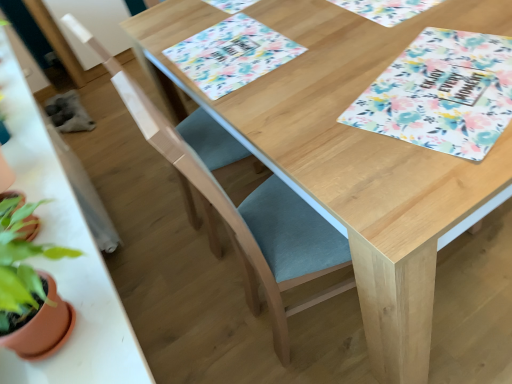
Question: From a real-world perspective, is floral fabric placemat at upper center, marked as the first place mat in a right-to-left arrangement, above or below teal fabric folding chair at center, placed as the 2th folding chair when sorted from front to back?

Choices:
 (A) above
 (B) below

Answer: (A)

Question: Is floral fabric placemat at upper center, marked as the first place mat in a right-to-left arrangement, inside the boundaries of teal fabric folding chair at center, the first folding chair viewed from the back, or outside?

Choices:
 (A) inside
 (B) outside

Answer: (B)

Question: Estimate the real-world distances between objects in this image. Which object is farther from the wooden table at left?

Choices:
 (A) floral fabric placemat at upper center, marked as the first place mat in a right-to-left arrangement
 (B) teal fabric folding chair at center, placed as the 2th folding chair when sorted from front to back
 (C) floral fabric placemat at upper right
 (D) floral paper placemat at center, which is the 2th place mat from right to left
 (E) light blue fabric folding chair at center, the 1th folding chair in the front-to-back sequence

Answer: (A)

Question: Which object is positioned closest to the floral paper placemat at center, which is the 2th place mat from right to left?

Choices:
 (A) floral fabric placemat at upper right
 (B) teal fabric folding chair at center, placed as the 2th folding chair when sorted from front to back
 (C) light blue fabric folding chair at center, the 2th folding chair viewed from the back
 (D) wooden table at left
 (E) floral fabric placemat at upper center, marked as the first place mat in a right-to-left arrangement

Answer: (B)